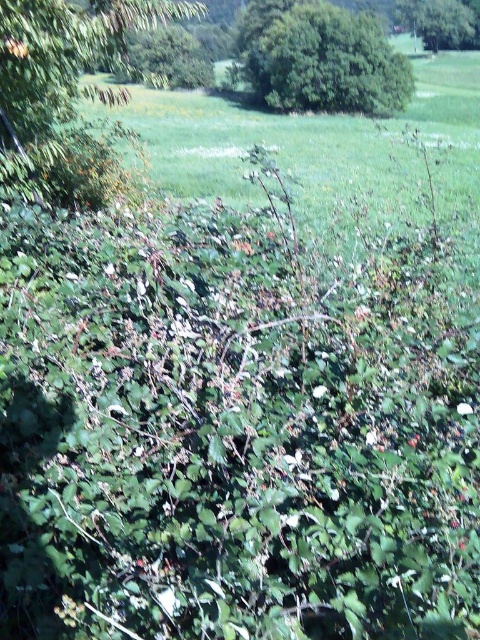
Between point (146, 12) and point (275, 51), which one is positioned in front?

Point (146, 12)

The height and width of the screenshot is (640, 480). Identify the location of green leafy tree at upper left. (63, 88).

Can you confirm if green leafy bush at upper center is positioned to the left of green leafy tree at upper center?

Yes, green leafy bush at upper center is to the left of green leafy tree at upper center.

Which of these two, green leafy bush at upper center or green leafy tree at upper center, stands taller?

green leafy bush at upper center

Between point (359, 40) and point (448, 44), which one is positioned behind?

The point (448, 44) is behind.

Find the location of a particular element. The height and width of the screenshot is (640, 480). green leafy bush at upper center is located at coordinates (321, 58).

Can you confirm if green leafy tree at upper left is wider than green leafy tree at upper center?

No.

Is point (56, 44) more distant than point (450, 1)?

No.

Locate an element on the screen. Image resolution: width=480 pixels, height=640 pixels. green leafy tree at upper left is located at coordinates (63, 88).